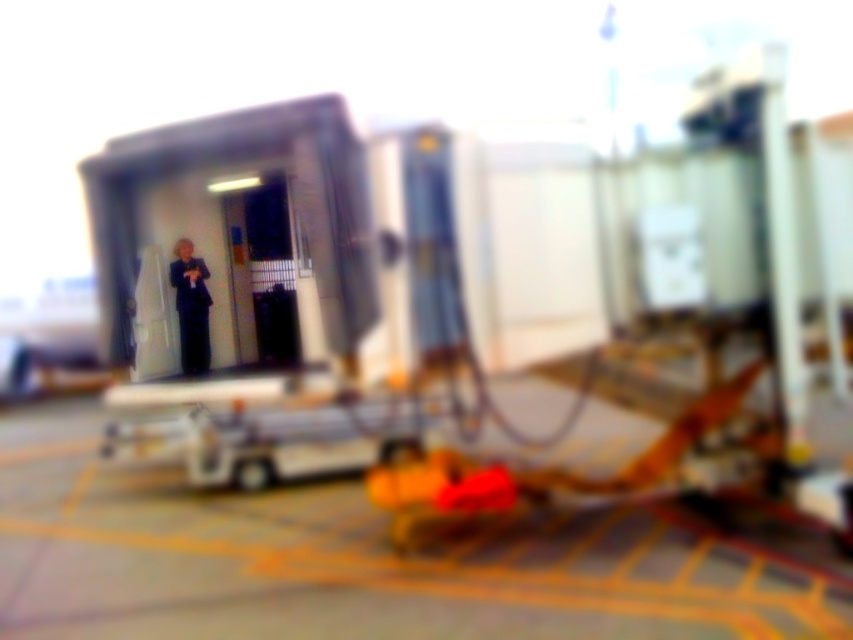
You are a passenger trying to locate your luggage at the airport. You see the yellow rubber mat at lower center and the dark blue suit at center. Which object is closer to you?

The yellow rubber mat at lower center is closer to you because it is in front of the dark blue suit at center.

You are a maintenance worker needing to walk from the yellow rubber mat at lower center to the dark blue suit at center. Considering the width of both objects, which path is wider and safer for carrying a wide tool?

The yellow rubber mat at lower center is wider than the dark blue suit at center, so the path near the yellow rubber mat at lower center would be wider and safer for carrying a wide tool.

You are a drone operator trying to capture a clear image of two specific points in the airport scene. The first point is at coordinates point (102, 621) and the second is at point (184, 307). Given the slight blur in the image, which point is more likely to be in focus?

Point (102, 621) is closer to the camera than point (184, 307), so it is more likely to be in focus.